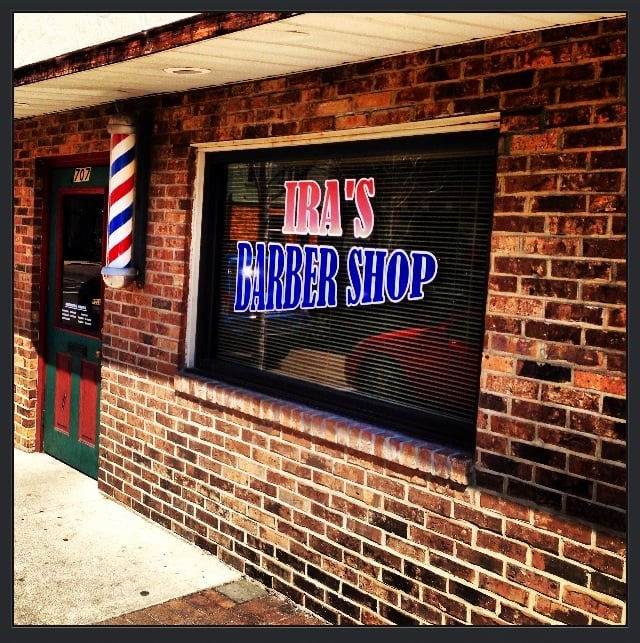
What are the coordinates of `gray tile` in the screenshot? It's located at (240, 592).